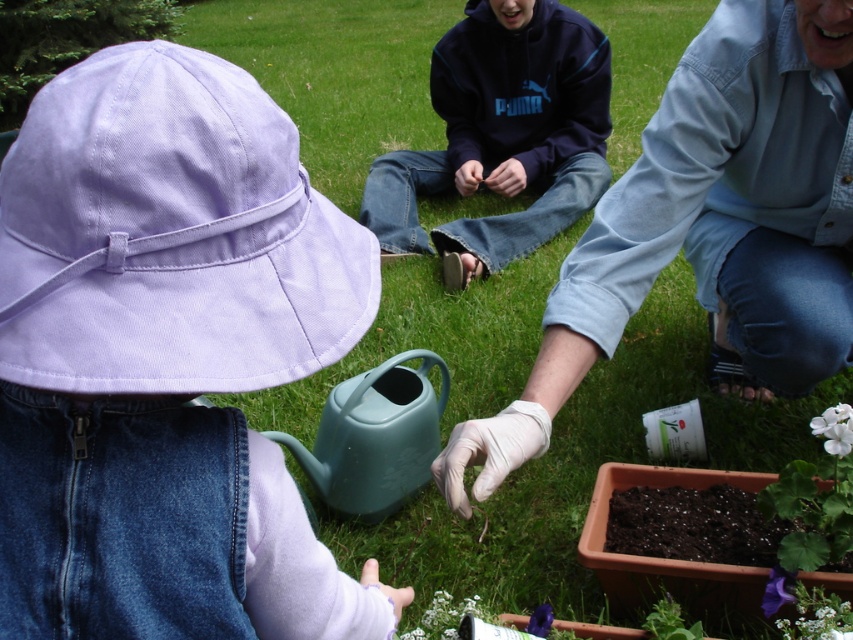
Question: Does navy blue hoodie at upper center have a smaller size compared to white matte flower at lower center?

Choices:
 (A) yes
 (B) no

Answer: (B)

Question: Which point is farther from the camera taking this photo?

Choices:
 (A) (537, 611)
 (B) (689, 160)

Answer: (B)

Question: Can you confirm if purple matte flower at lower right is positioned to the left of purple matte flower at lower center?

Choices:
 (A) no
 (B) yes

Answer: (A)

Question: Which of the following is the closest to the observer?

Choices:
 (A) white latex glove at center
 (B) purple matte flower at lower right

Answer: (A)

Question: Is navy blue hoodie at upper center below purple matte flower at lower center?

Choices:
 (A) yes
 (B) no

Answer: (B)

Question: Estimate the real-world distances between objects in this image. Which object is closer to the white latex glove at center?

Choices:
 (A) purple matte flower at lower right
 (B) navy blue hoodie at upper center
 (C) lavender cotton hat at upper left
 (D) white matte flower at lower right

Answer: (D)